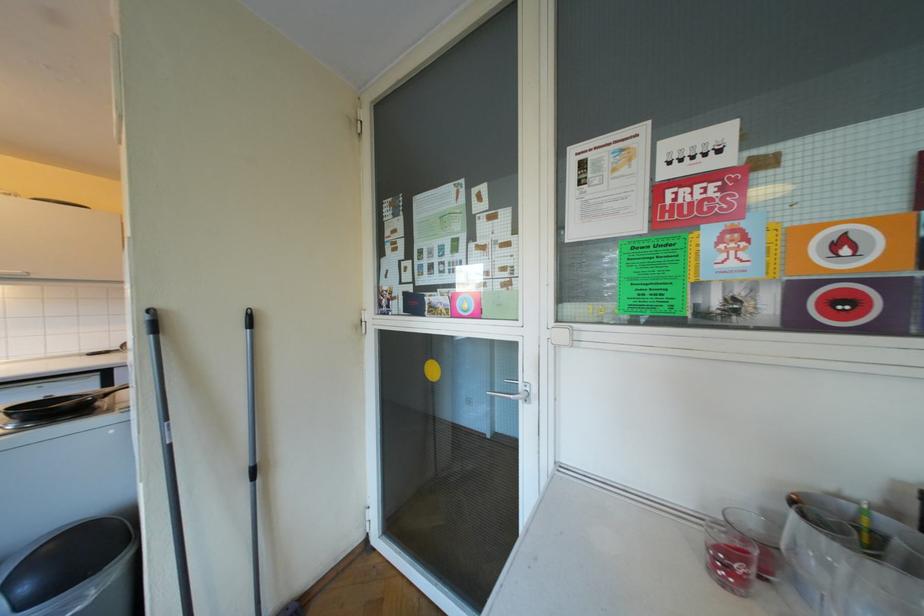
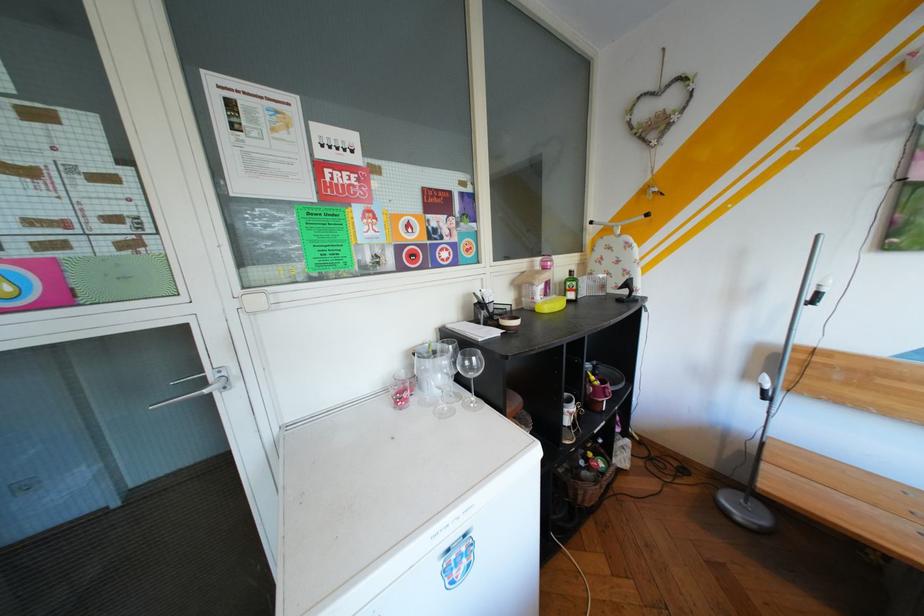
The point at [533,389] is marked in the first image. Where is the corresponding point in the second image?

(225, 379)